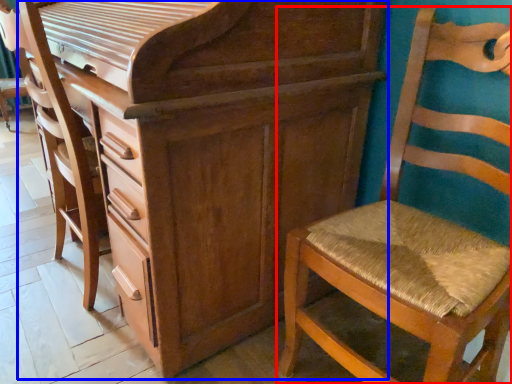
Question: Which point is further to the camera, chair (highlighted by a red box) or chest of drawers (highlighted by a blue box)?

Choices:
 (A) chair
 (B) chest of drawers

Answer: (B)